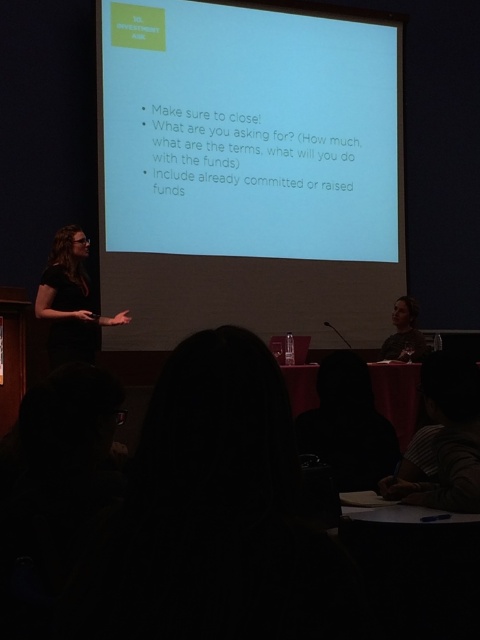
Is white matte projection screen at center positioned behind black matte shirt at left?

Yes, white matte projection screen at center is behind black matte shirt at left.

Between white matte projection screen at center and black matte shirt at left, which one appears on the right side from the viewer's perspective?

white matte projection screen at center is more to the right.

Does point (324, 276) lie behind point (67, 259)?

Yes, point (324, 276) is behind point (67, 259).

Identify the location of white matte projection screen at center. This screenshot has width=480, height=640. (248, 170).